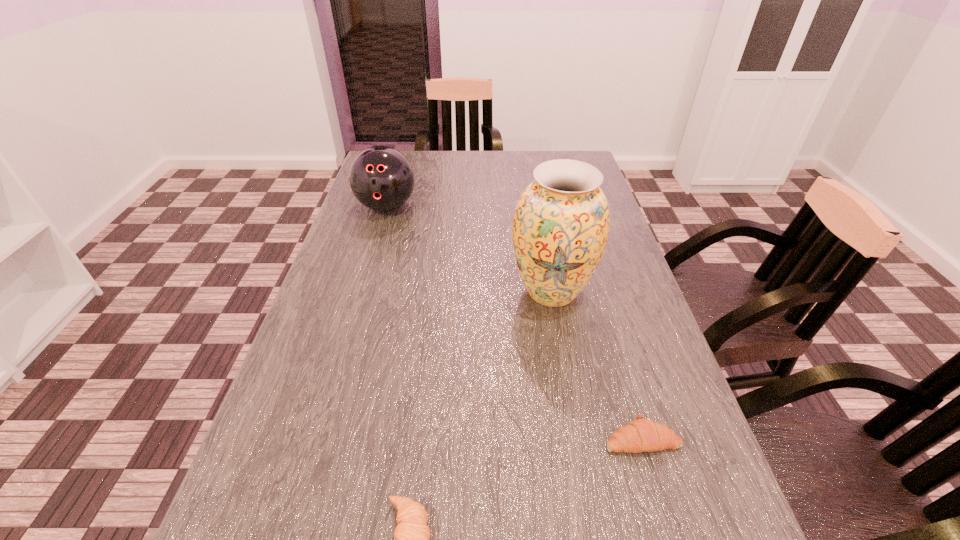
Find the location of a particular element. vase is located at coordinates (560, 229).

Where is `the third nearest object`? the third nearest object is located at coordinates (560, 229).

Where is `bowling ball`? The height and width of the screenshot is (540, 960). bowling ball is located at coordinates (381, 178).

Image resolution: width=960 pixels, height=540 pixels. In order to click on the farthest object in this screenshot , I will do pyautogui.click(x=381, y=178).

This screenshot has width=960, height=540. I want to click on the right crescent roll, so click(641, 435).

This screenshot has height=540, width=960. Find the location of `the farther crescent roll`. the farther crescent roll is located at coordinates (641, 435).

Where is `vacant space located on the front of the vase`? The image size is (960, 540). vacant space located on the front of the vase is located at coordinates (589, 507).

I want to click on free space located on the surface of the leftmost object near the finger holes, so click(367, 274).

Locate an element on the screen. This screenshot has width=960, height=540. vacant space situated on the back of the second nearest object is located at coordinates (623, 375).

Locate an element on the screen. object that is at the left edge is located at coordinates (381, 178).